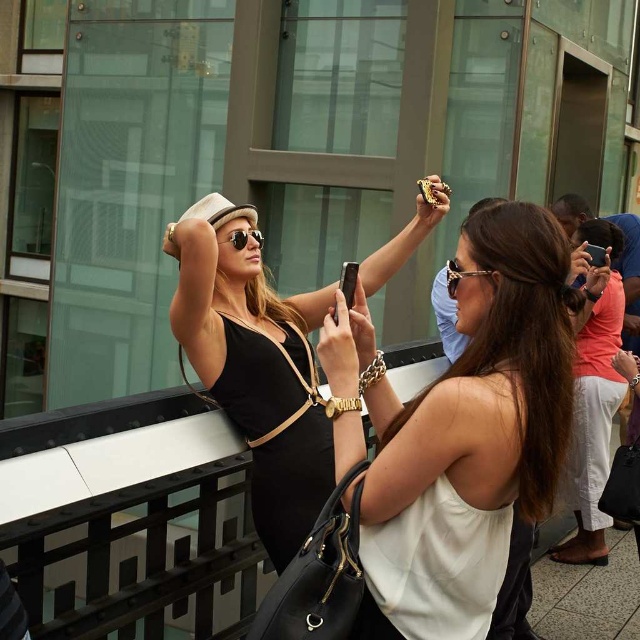
You are a delivery robot with a 1.2 meter wide package. You need to pass between the white matte tank top at center and the matte black sunglasses at upper center. Can you fit through the space between them?

The distance between the white matte tank top at center and the matte black sunglasses at upper center is 1.18 meters. Since the package is 1.2 meters wide, it is slightly wider than the available space. Therefore, the robot cannot fit through the space between them.

Looking at the scene, where is the matte black dress at center in relation to the matte black sunglasses at upper center?

The matte black dress at center is to the right of the matte black sunglasses at upper center.

You are a photographer trying to capture a closeup of the woman on the left. The point at coordinates point (x=468, y=385) is on the white matte tank top at center. Which woman is closer to the camera?

The point at coordinates point (x=468, y=385) is on the white matte tank top at center, which belongs to the woman on the right. Therefore, the woman on the right is closer to the camera.